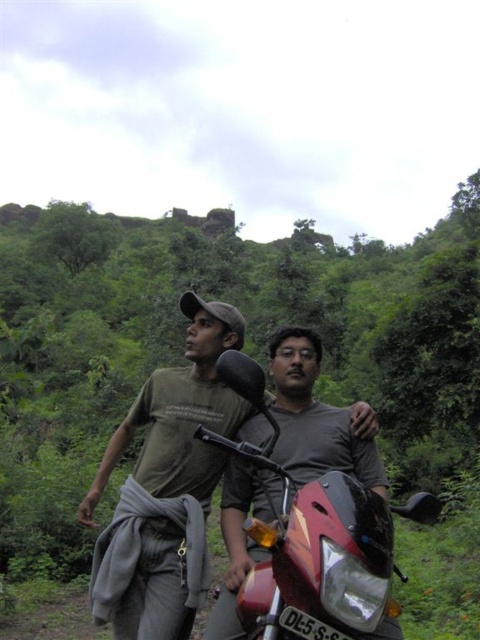
Does green leafy vegetation at center appear on the left side of green cotton shirt at center?

Correct, you'll find green leafy vegetation at center to the left of green cotton shirt at center.

Can you confirm if green leafy vegetation at center is taller than green cotton shirt at center?

Correct, green leafy vegetation at center is much taller as green cotton shirt at center.

This screenshot has height=640, width=480. What do you see at coordinates (245, 349) in the screenshot? I see `green leafy vegetation at center` at bounding box center [245, 349].

Image resolution: width=480 pixels, height=640 pixels. I want to click on green leafy vegetation at center, so click(x=245, y=349).

Does green cotton shirt at center appear on the left side of shiny red motorcycle at center?

Indeed, green cotton shirt at center is positioned on the left side of shiny red motorcycle at center.

You are a GUI agent. You are given a task and a screenshot of the screen. Output one action in this format:
    pyautogui.click(x=<x>, y=<y>)
    Task: Click on the green cotton shirt at center
    This screenshot has width=480, height=640.
    Given the screenshot: What is the action you would take?
    pyautogui.click(x=166, y=486)

At what (x,y) coordinates should I click in order to perform the action: click on green cotton shirt at center. Please return your answer as a coordinate pair (x, y). This screenshot has width=480, height=640. Looking at the image, I should click on (166, 486).

The width and height of the screenshot is (480, 640). In order to click on green cotton shirt at center in this screenshot , I will do `click(166, 486)`.

This screenshot has height=640, width=480. What are the coordinates of `green leafy vegetation at center` in the screenshot? It's located at tap(245, 349).

Is point (479, 262) positioned in front of point (315, 524)?

That is False.

You are a GUI agent. You are given a task and a screenshot of the screen. Output one action in this format:
    pyautogui.click(x=<x>, y=<y>)
    Task: Click on the green leafy vegetation at center
    The image size is (480, 640).
    Given the screenshot: What is the action you would take?
    pyautogui.click(x=245, y=349)